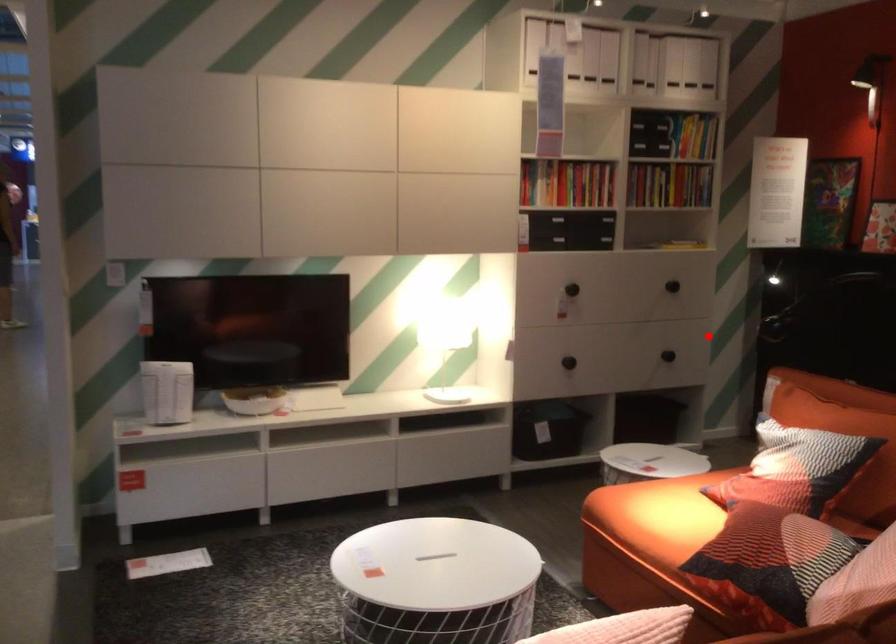
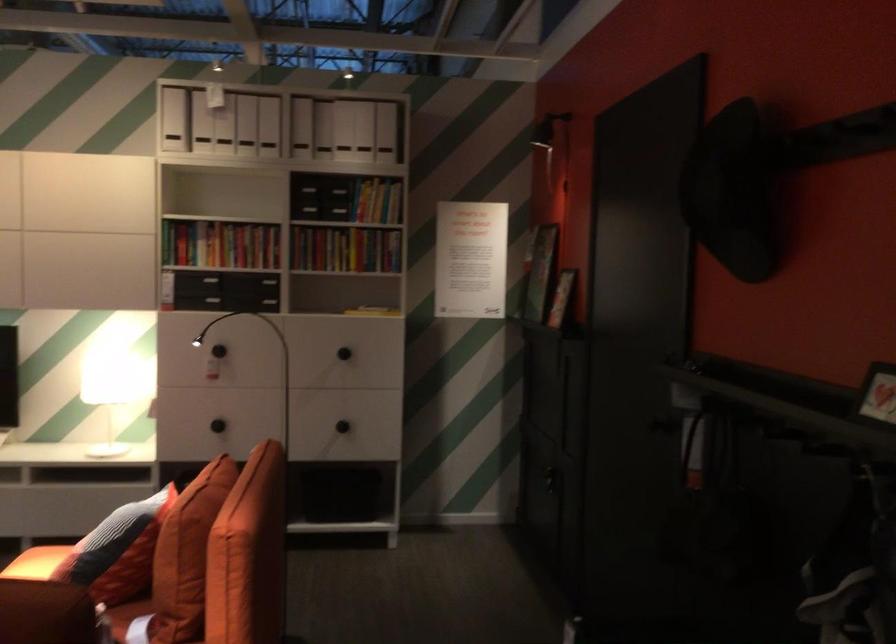
Locate, in the second image, the point that corresponds to the highlighted location in the first image.

(341, 426)